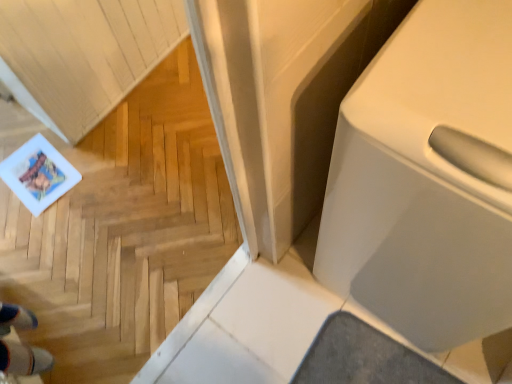
Question: Based on their positions, is white glossy toilet at right located to the left or right of light wood parquet floor at lower left?

Choices:
 (A) right
 (B) left

Answer: (A)

Question: Is white glossy toilet at right taller or shorter than light wood parquet floor at lower left?

Choices:
 (A) short
 (B) tall

Answer: (A)

Question: Looking at their shapes, would you say white glossy toilet at right is wider or thinner than light wood parquet floor at lower left?

Choices:
 (A) wide
 (B) thin

Answer: (A)

Question: From the image's perspective, relative to white glossy toilet at right, is light wood parquet floor at lower left above or below?

Choices:
 (A) above
 (B) below

Answer: (B)

Question: Would you say light wood parquet floor at lower left is to the left or to the right of white glossy toilet at right in the picture?

Choices:
 (A) right
 (B) left

Answer: (B)

Question: Is point (189, 127) closer or farther from the camera than point (422, 221)?

Choices:
 (A) closer
 (B) farther

Answer: (B)

Question: Is light wood parquet floor at lower left in front of or behind white glossy toilet at right in the image?

Choices:
 (A) front
 (B) behind

Answer: (A)